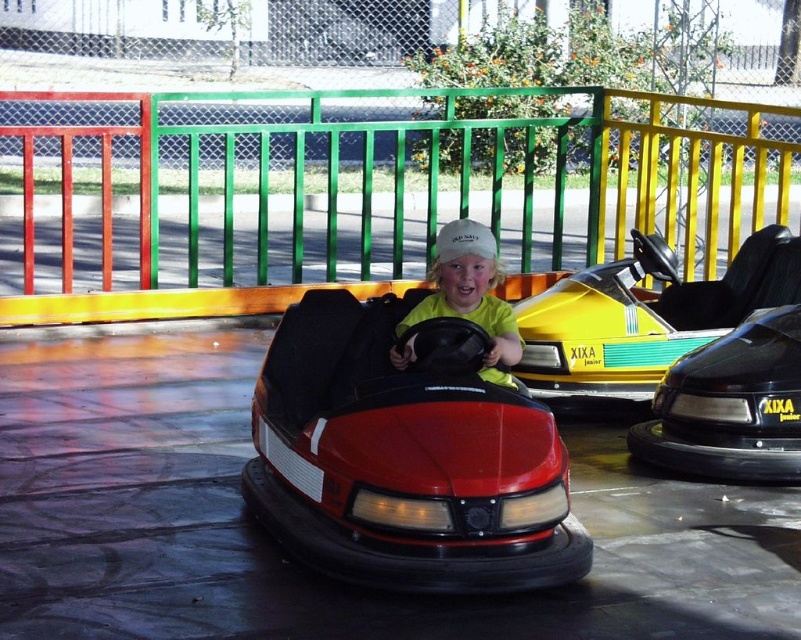
You are standing at the entrance of the bumper car ride and want to locate the shiny red bumper car at center. According to the coordinates provided, where should you look to find it?

The shiny red bumper car at center is located at point (405, 456), so you should look towards the center area of the bumper car enclosure where those coordinates point to.

You are standing at the bumper car ride and want to know which of the two points, point (783,420) or point (496,321), is closer to you. Which one is closer?

Point (496,321) is closer to you because it is less further away than point (783,420).

You are a safety inspector checking the bumper car ride. The minimum safe distance between the bumper car and any rider is 20 inches. Is the shiny red bumper car at center compliant with safety regulations regarding the yellow matte shirt at center?

The shiny red bumper car at center is 19.59 inches from the yellow matte shirt at center, which is less than the required 20 inches. Therefore, it does not comply with safety regulations.